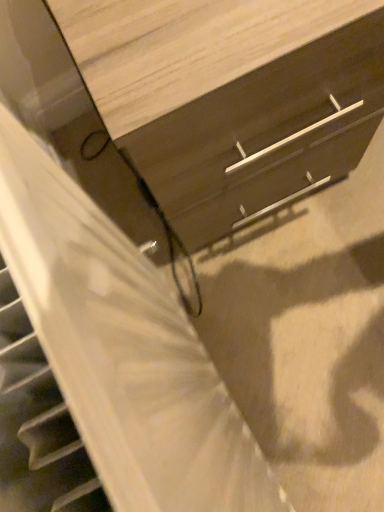
This screenshot has height=512, width=384. Describe the element at coordinates (265, 132) in the screenshot. I see `matte wood drawer at upper center` at that location.

This screenshot has height=512, width=384. Find the location of `matte wood drawer at upper center`. matte wood drawer at upper center is located at coordinates (265, 132).

What are the coordinates of `matte wood drawer at upper center` in the screenshot? It's located at [x=265, y=132].